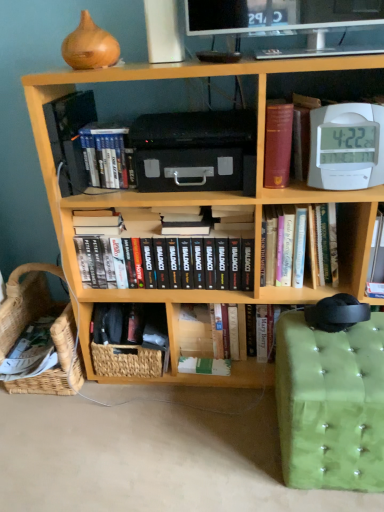
This screenshot has height=512, width=384. Find the location of `vacant space in between green tufted fabric swivel chair at lower right and white paper at center, the third paperback book from the top`. vacant space in between green tufted fabric swivel chair at lower right and white paper at center, the third paperback book from the top is located at coordinates (246, 414).